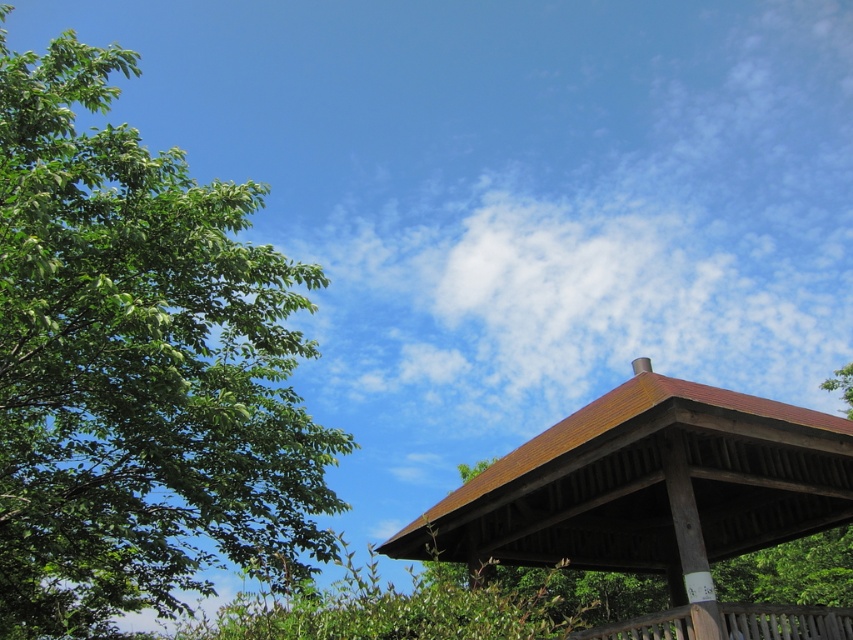
Between green leafy tree at left and brown wooden gazebo at center, which one has more height?

green leafy tree at left is taller.

Is green leafy tree at left above brown wooden gazebo at center?

Indeed, green leafy tree at left is positioned over brown wooden gazebo at center.

Describe the element at coordinates (138, 365) in the screenshot. The height and width of the screenshot is (640, 853). I see `green leafy tree at left` at that location.

Where is `green leafy tree at left`? This screenshot has width=853, height=640. green leafy tree at left is located at coordinates [x=138, y=365].